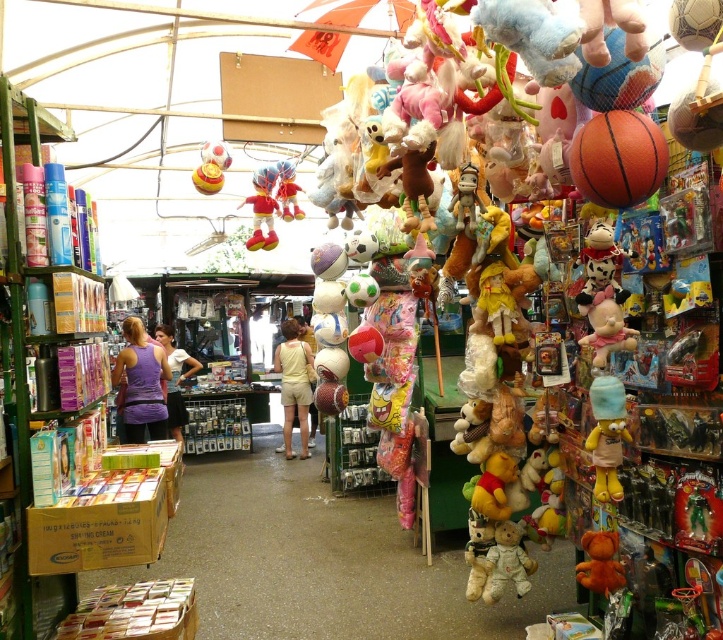
Is point (294, 401) farther from camera compared to point (247, 244)?

That is True.

Measure the distance from yellow cotton shorts at center to velvet plush toy at center.

yellow cotton shorts at center is 9.04 feet from velvet plush toy at center.

The height and width of the screenshot is (640, 723). Describe the element at coordinates (294, 385) in the screenshot. I see `yellow cotton shorts at center` at that location.

What are the coordinates of `yellow cotton shorts at center` in the screenshot? It's located at (294, 385).

Which of these two, yellow plush bear at right or shiny yellow rubber duck at center, stands shorter?

With less height is yellow plush bear at right.

Can you confirm if yellow plush bear at right is smaller than shiny yellow rubber duck at center?

Indeed, yellow plush bear at right has a smaller size compared to shiny yellow rubber duck at center.

Is point (615, 451) farther from viewer compared to point (200, 164)?

That is False.

You are a GUI agent. You are given a task and a screenshot of the screen. Output one action in this format:
    pyautogui.click(x=<x>, y=<y>)
    Task: Click on the yellow plush bear at right
    The image size is (723, 640).
    Given the screenshot: What is the action you would take?
    pyautogui.click(x=607, y=435)

Does point (129, 404) come farther from viewer compared to point (269, 180)?

Yes.

Can you confirm if purple fabric tank top at center is taller than velvet plush toy at center?

Yes.

The height and width of the screenshot is (640, 723). Describe the element at coordinates (141, 385) in the screenshot. I see `purple fabric tank top at center` at that location.

The width and height of the screenshot is (723, 640). I want to click on purple fabric tank top at center, so [141, 385].